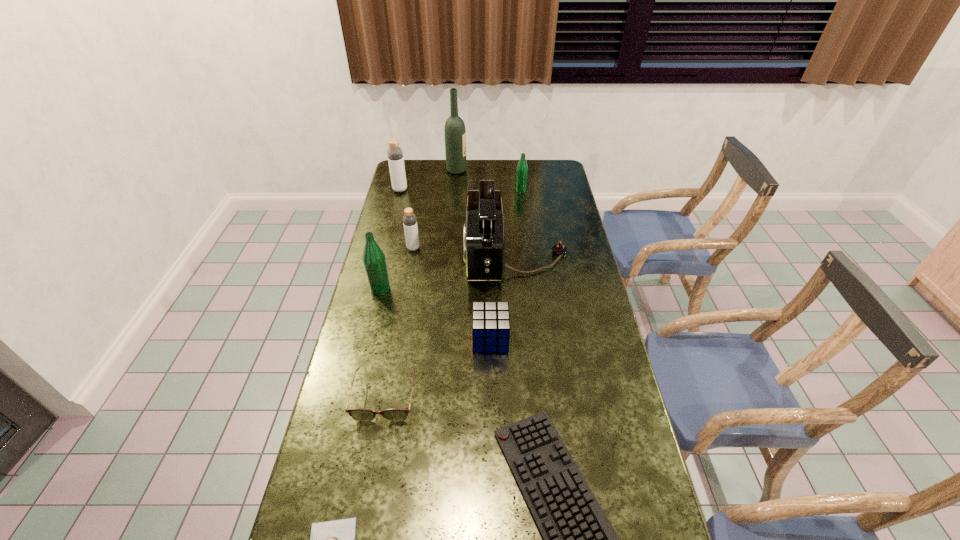
Image resolution: width=960 pixels, height=540 pixels. Find the location of `green wine bottle`. green wine bottle is located at coordinates (454, 131).

At what (x,y) coordinates should I click in order to perform the action: click on the farthest object. Please return your answer as a coordinate pair (x, y). Looking at the image, I should click on (454, 131).

This screenshot has height=540, width=960. I want to click on radio receiver, so click(x=483, y=242).

Where is `the bigger gray bottle`? The image size is (960, 540). the bigger gray bottle is located at coordinates [394, 153].

The image size is (960, 540). I want to click on the farther gray bottle, so click(x=394, y=153).

Locate an element on the screen. The image size is (960, 540). the bigger green bottle is located at coordinates (374, 261).

Locate an element on the screen. The width and height of the screenshot is (960, 540). the nearer green bottle is located at coordinates (374, 261).

At what (x,y) coordinates should I click in order to perform the action: click on the right green bottle. Please return your answer as a coordinate pair (x, y). The height and width of the screenshot is (540, 960). Looking at the image, I should click on (522, 168).

I want to click on the rightmost bottle, so click(x=522, y=168).

Locate an element on the screen. This screenshot has width=960, height=540. the second bottle from right to left is located at coordinates (409, 219).